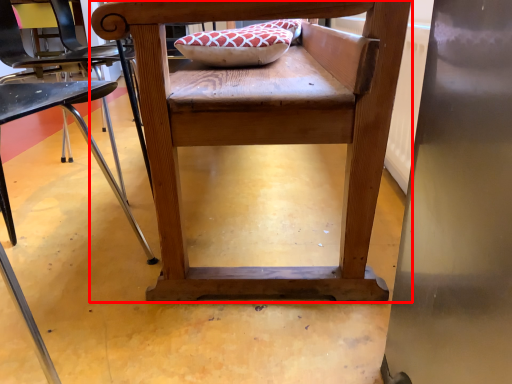
Question: Where is chair (annotated by the red box) located in relation to chair in the image?

Choices:
 (A) right
 (B) left

Answer: (A)